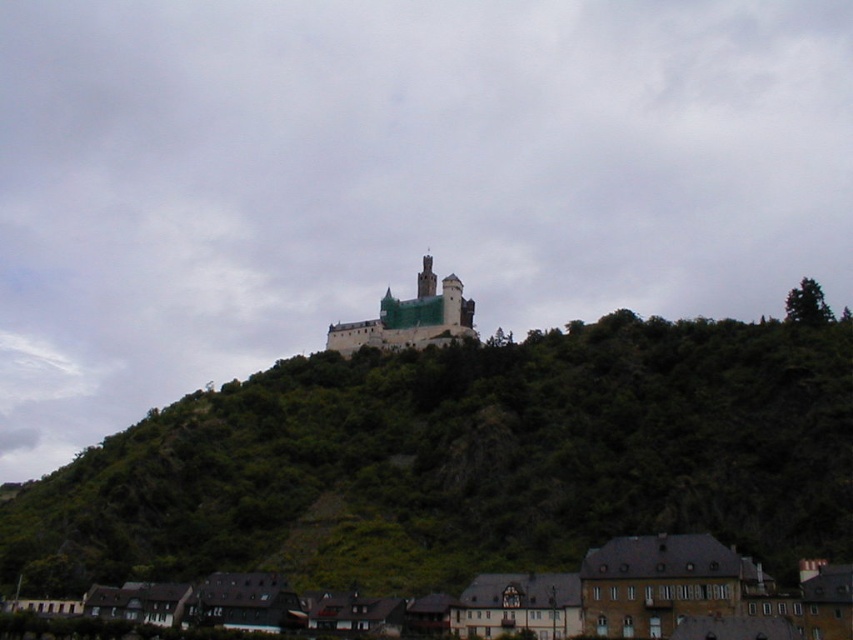
Is brown stone buildings at lower center shorter than stone medieval castle at center?

Correct, brown stone buildings at lower center is not as tall as stone medieval castle at center.

Is brown stone buildings at lower center bigger than stone medieval castle at center?

Correct, brown stone buildings at lower center is larger in size than stone medieval castle at center.

Does point (627, 570) come farther from viewer compared to point (457, 298)?

That is False.

Where is `brown stone buildings at lower center`? The image size is (853, 640). brown stone buildings at lower center is located at coordinates (648, 593).

Measure the distance from green leafy hillside at center to stone medieval castle at center.

green leafy hillside at center is 37.99 meters away from stone medieval castle at center.

Between green leafy hillside at center and stone medieval castle at center, which one is positioned lower?

green leafy hillside at center is below.

Where is `green leafy hillside at center`? green leafy hillside at center is located at coordinates (468, 460).

Is green leafy hillside at center behind brown stone buildings at lower center?

Yes, it is.

Does green leafy hillside at center lie in front of brown stone buildings at lower center?

No, green leafy hillside at center is behind brown stone buildings at lower center.

You are a GUI agent. You are given a task and a screenshot of the screen. Output one action in this format:
    pyautogui.click(x=<x>, y=<y>)
    Task: Click on the green leafy hillside at center
    
    Given the screenshot: What is the action you would take?
    pyautogui.click(x=468, y=460)

Image resolution: width=853 pixels, height=640 pixels. Identify the location of green leafy hillside at center. (468, 460).